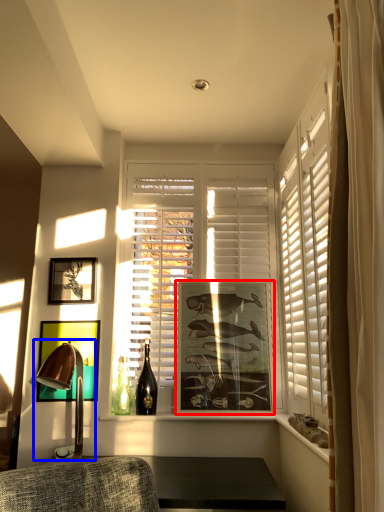
Question: Which point is further to the camera, picture frame (highlighted by a red box) or table lamp (highlighted by a blue box)?

Choices:
 (A) picture frame
 (B) table lamp

Answer: (A)